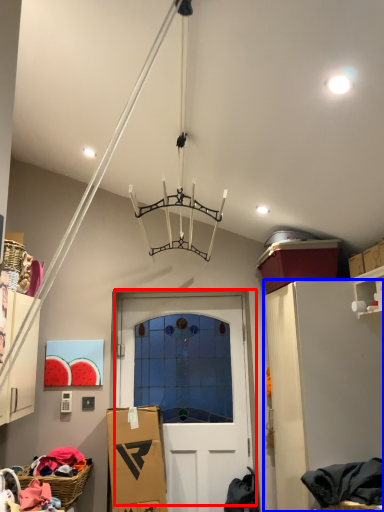
Question: Which object appears farthest to the camera in this image, door (highlighted by a red box) or cabinetry (highlighted by a blue box)?

Choices:
 (A) door
 (B) cabinetry

Answer: (A)